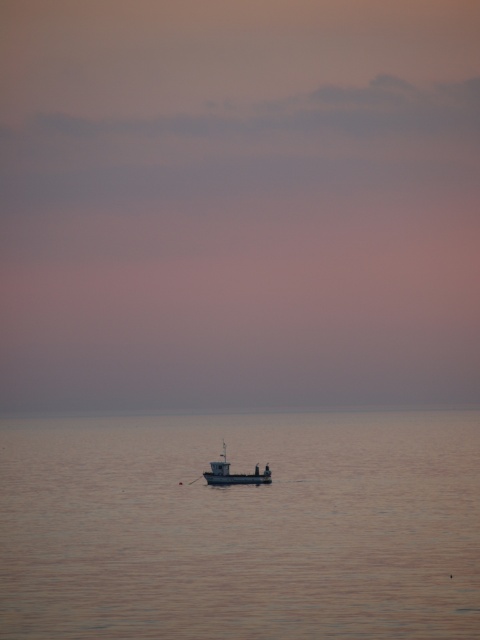
Can you confirm if smooth water at center is positioned below metallic gray boat at center?

Yes, smooth water at center is below metallic gray boat at center.

Who is more distant from viewer, (x=312, y=582) or (x=239, y=483)?

Point (x=239, y=483)

Identify the location of smooth water at center. The image size is (480, 640). (240, 525).